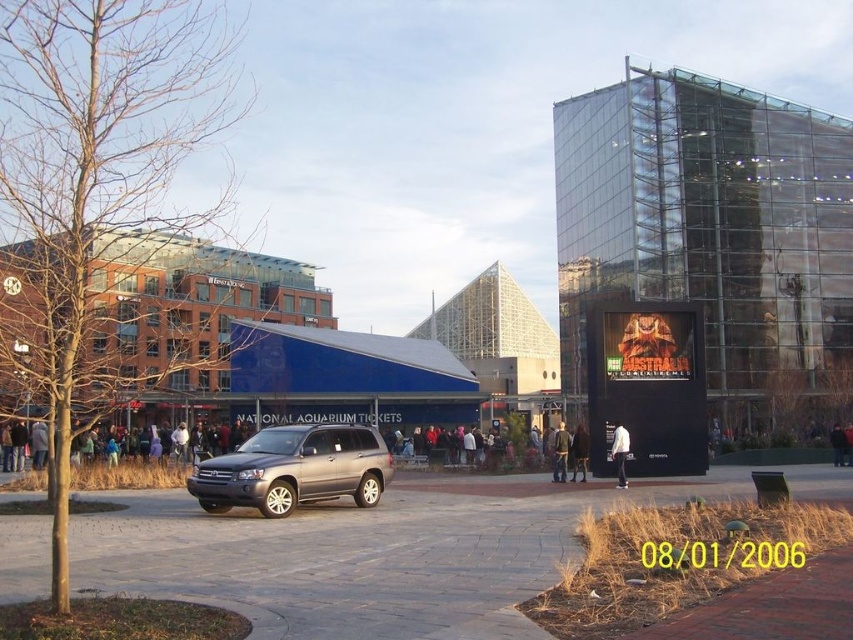
You are a tourist standing in front of the glass building and want to buy tickets for the National Aquarium. You see two jackets, the denim jacket at center and the dark blue jacket at center. Which jacket is closer to the glass building?

The denim jacket at center is to the left of dark blue jacket at center, but their distance to the glass building isn not specified in the description. Therefore, it is impossible to determine which jacket is closer to the glass building based on the provided information.

You are a tourist standing in front of the glassy modern building at center and the dark blue jacket at center. Which object is taller?

The glassy modern building at center is much taller than the dark blue jacket at center.

You are standing in the urban scene and want to buy tickets for the National Aquarium. The blue glass building at center and dark gray jacket at center are both visible. Which direction should you move to reach the ticket booth?

The blue glass building at center is positioned on the left side of dark gray jacket at center, so you should move to the left to reach the ticket booth located at the blue glass building at center.